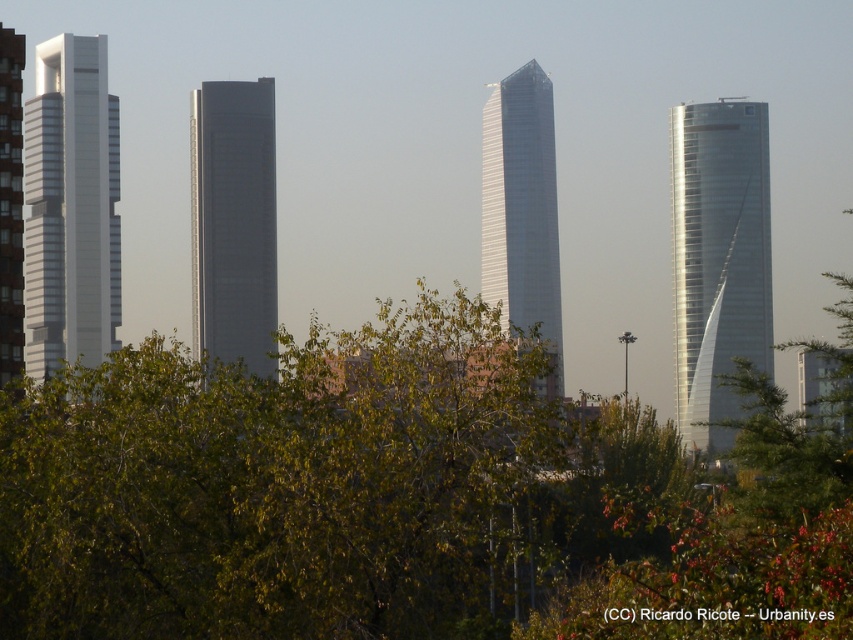
Question: Can you confirm if sleek metallic tower at right is positioned to the left of smooth glass skyscraper at center?

Choices:
 (A) no
 (B) yes

Answer: (A)

Question: Is green leafy tree at center smaller than white smooth skyscraper at left?

Choices:
 (A) yes
 (B) no

Answer: (B)

Question: Among these points, which one is farthest from the camera?

Choices:
 (A) (770, 305)
 (B) (15, 36)

Answer: (B)

Question: Which object is the closest to the smooth glass skyscraper at center?

Choices:
 (A) matte glass skyscraper at left
 (B) shiny glass skyscraper at center
 (C) sleek metallic tower at right
 (D) white smooth skyscraper at left

Answer: (D)

Question: Which object is the closest to the shiny glass skyscraper at center?

Choices:
 (A) matte glass skyscraper at left
 (B) green leafy tree at center

Answer: (B)

Question: Does green leafy tree at center have a lesser width compared to white smooth skyscraper at left?

Choices:
 (A) no
 (B) yes

Answer: (A)